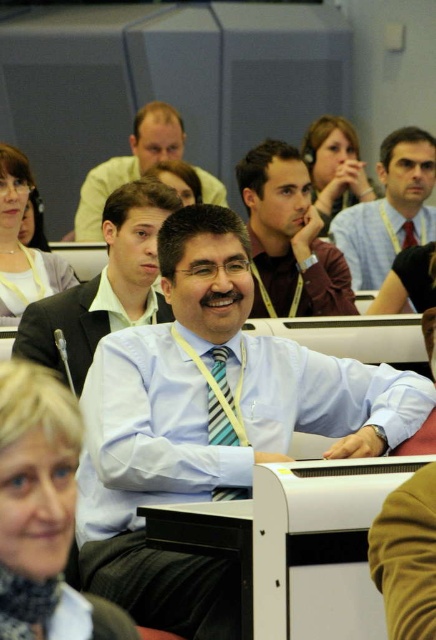
From the picture: Measure the distance between point (184, 291) and camera.

A distance of 9.75 feet exists between point (184, 291) and camera.

Can you confirm if light blue shirt at center is smaller than yellow striped tie at center?

No, light blue shirt at center is not smaller than yellow striped tie at center.

Image resolution: width=436 pixels, height=640 pixels. Describe the element at coordinates (207, 424) in the screenshot. I see `light blue shirt at center` at that location.

You are a GUI agent. You are given a task and a screenshot of the screen. Output one action in this format:
    pyautogui.click(x=<x>, y=<y>)
    Task: Click on the light blue shirt at center
    Image resolution: width=436 pixels, height=640 pixels.
    Given the screenshot: What is the action you would take?
    pyautogui.click(x=207, y=424)

Does smooth brown shirt at center have a lesser height compared to matte black shirt at center?

Yes, smooth brown shirt at center is shorter than matte black shirt at center.

Is point (337, 300) farther from camera compared to point (115, 173)?

No, it is in front of (115, 173).

Is point (296, 170) farther from camera compared to point (125, 179)?

No, it is not.

Find the location of `smooth brown shirt at center`. smooth brown shirt at center is located at coordinates (289, 237).

Between white glossy shirt at center and light brown leather jacket at upper center, which one has more height?

light brown leather jacket at upper center is taller.

Is point (109, 236) closer to viewer compared to point (422, 157)?

That is True.

Find the location of a particular element. The width and height of the screenshot is (436, 640). white glossy shirt at center is located at coordinates (105, 285).